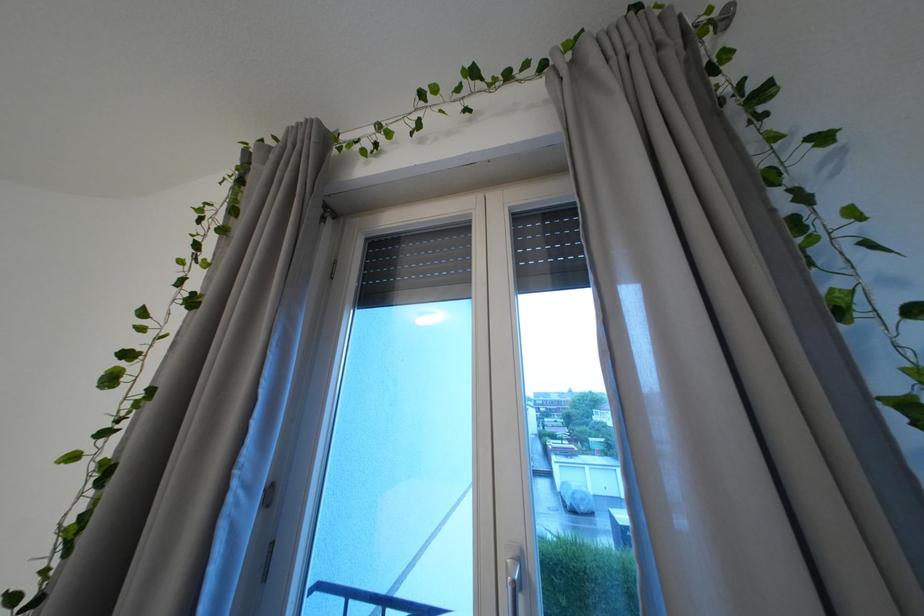
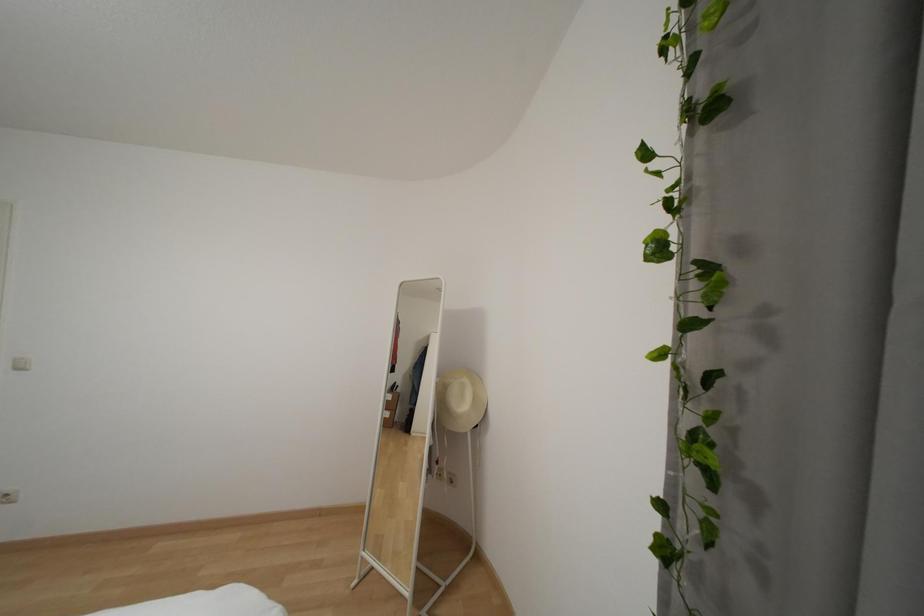
Question: The camera is either moving clockwise (left) or counter-clockwise (right) around the object. The first image is from the beginning of the video and the second image is from the end. Is the camera moving left or right when shooting the video?

Choices:
 (A) Left
 (B) Right

Answer: (B)